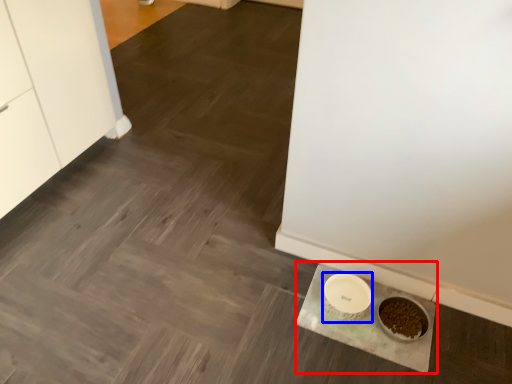
Question: Which object appears closest to the camera in this image, slate (highlighted by a red box) or bowl (highlighted by a blue box)?

Choices:
 (A) slate
 (B) bowl

Answer: (A)